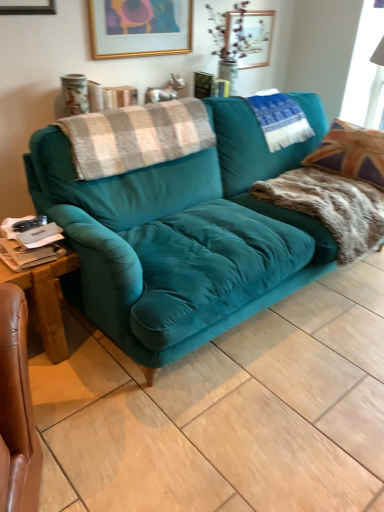
Question: In the image, is teal velvet pillow at upper right positioned in front of or behind teal velvet couch at center?

Choices:
 (A) behind
 (B) front

Answer: (A)

Question: Considering the positions of point (286, 131) and point (170, 356), is point (286, 131) closer or farther from the camera than point (170, 356)?

Choices:
 (A) farther
 (B) closer

Answer: (A)

Question: Which object is positioned farthest from the white fabric at upper right?

Choices:
 (A) fuzzy brown blanket at right, acting as the second blanket starting from the left
 (B) teal velvet pillow at upper right
 (C) fur-like fabric pillow at right
 (D) teal velvet couch at center
 (E) wooden picture frame at upper center, which is counted as the second picture frame, starting from the front

Answer: (D)

Question: Estimate the real-world distances between objects in this image. Which object is closer to the wooden picture frame at upper center, the first picture frame viewed from the back?

Choices:
 (A) gold-framed picture at upper center, arranged as the 2th picture frame when viewed from the right
 (B) fuzzy brown blanket at right, the 1th blanket in the right-to-left sequence
 (C) plaid woolen blanket at upper left, the first blanket from the left
 (D) fur-like fabric pillow at right
 (E) teal velvet pillow at upper right

Answer: (E)